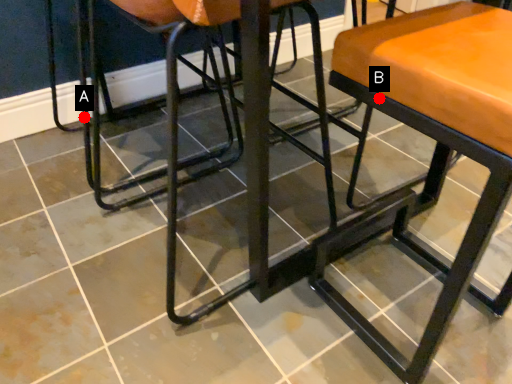
Question: Two points are circled on the image, labeled by A and B beside each circle. Which point appears closest to the camera in this image?

Choices:
 (A) A is closer
 (B) B is closer

Answer: (B)